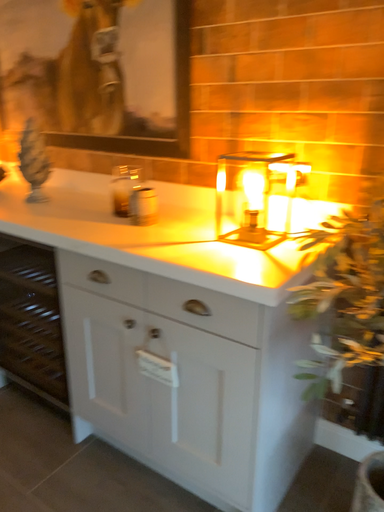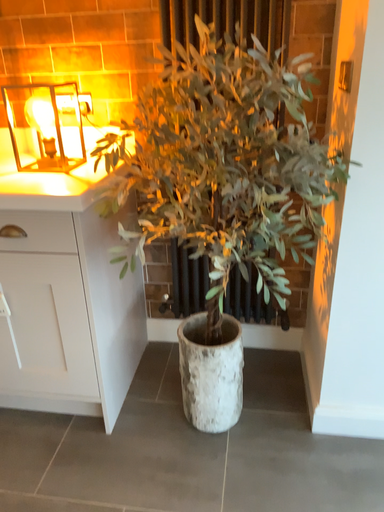
Question: How did the camera likely rotate when shooting the video?

Choices:
 (A) rotated left
 (B) rotated right

Answer: (B)